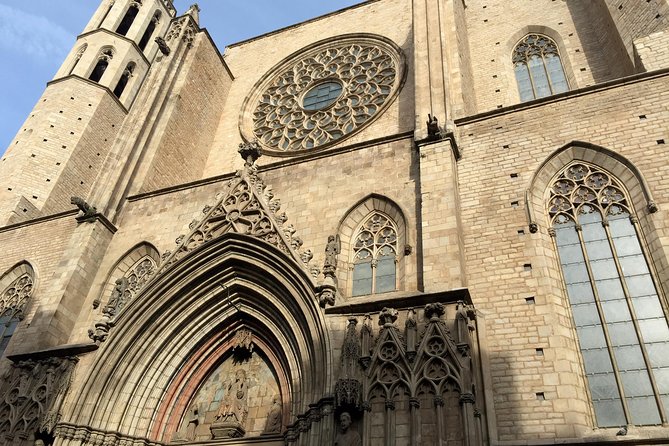
Locate an element on the screen. Image resolution: width=669 pixels, height=446 pixels. top most tip of doorway is located at coordinates (248, 148).